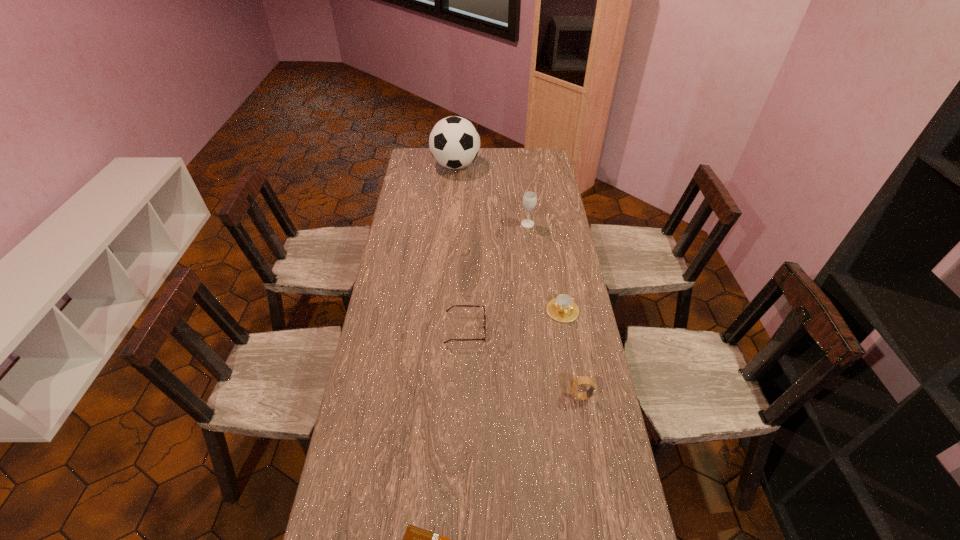
Identify the location of free spot located 0.150m on the face of the watch. This screenshot has width=960, height=540. (522, 397).

The width and height of the screenshot is (960, 540). I want to click on free spot located on the face of the watch, so click(x=532, y=397).

I want to click on vacant space located on the face of the watch, so click(x=510, y=397).

Where is `free space located with the handle on the side of the cup`? free space located with the handle on the side of the cup is located at coordinates (581, 413).

At what (x,y) coordinates should I click in order to perform the action: click on vacant region located on the lenses of the spectacles. Please return your answer as a coordinate pair (x, y). The height and width of the screenshot is (540, 960). Looking at the image, I should click on (525, 329).

Where is `object that is at the far edge`? The width and height of the screenshot is (960, 540). object that is at the far edge is located at coordinates (454, 142).

The height and width of the screenshot is (540, 960). Identify the location of object located in the left edge section of the desktop. (454, 142).

Locate an element on the screen. The width and height of the screenshot is (960, 540). wineglass positioned at the right edge is located at coordinates (529, 199).

Find the location of `watch that is at the right edge`. watch that is at the right edge is located at coordinates (575, 383).

Locate an element on the screen. cup present at the right edge is located at coordinates (563, 309).